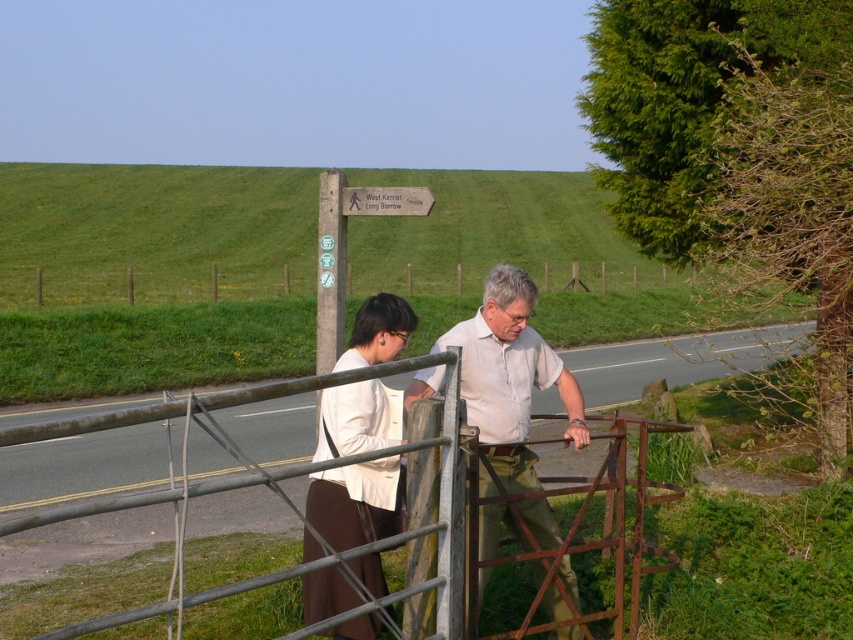
You are standing at the entrance of a rural path and see the green wooden fence at center and the wooden signpost at upper center. Which object is closer to your left side?

The green wooden fence at center is closer to your left side as it is positioned to the left of the wooden signpost at upper center.

You are standing at the camera position and want to reach the point marked as point (x=496, y=456). Is the distance less than 6 meters?

The distance between the camera and point (x=496, y=456) is 5.97 meters, which is less than 6 meters.

You are planning to install a new fence and want to ensure it matches the existing structures in the scene. Based on the image, which object should you consider for size comparison between the green wooden fence at center and the wooden signpost at upper center?

The green wooden fence at center is wider than the wooden signpost at upper center, so you should consider its width when planning the new fence installation.